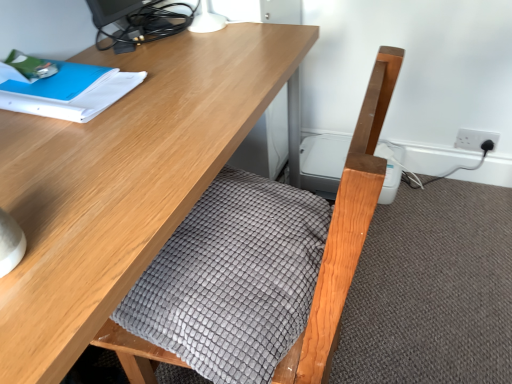
Locate an element on the screen. free location to the right of blue paper at upper left is located at coordinates (180, 88).